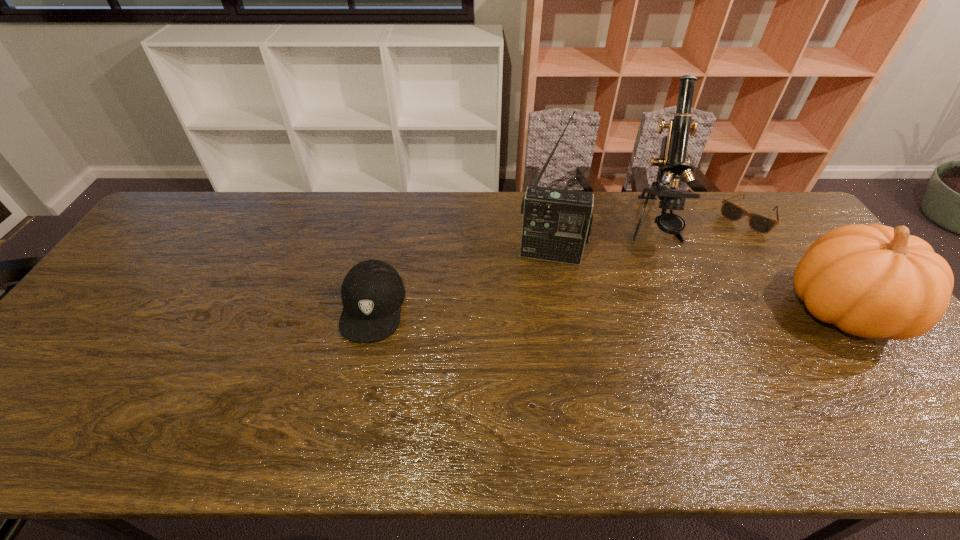
This screenshot has height=540, width=960. I want to click on free space on the desktop that is between the fourth tallest object and the pumpkin and is positioned through the eyepiece of the microscope, so click(671, 309).

Where is `free spot on the desktop that is between the leftmost object and the pumpkin and is positioned on the frames of the shortest object`? The width and height of the screenshot is (960, 540). free spot on the desktop that is between the leftmost object and the pumpkin and is positioned on the frames of the shortest object is located at coordinates (674, 309).

The image size is (960, 540). I want to click on free space on the desktop that is between the fourth tallest object and the pumpkin and is positioned on the display of the radio receiver, so click(544, 308).